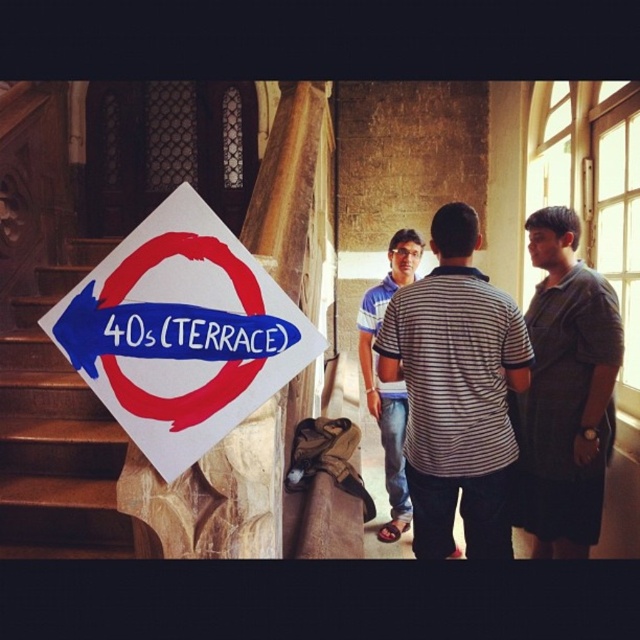
Describe the element at coordinates (180, 332) in the screenshot. This screenshot has height=640, width=640. I see `white paper sign at upper left` at that location.

Can you confirm if white paper sign at upper left is taller than striped cotton shirt at center?

Incorrect, white paper sign at upper left's height is not larger of striped cotton shirt at center's.

Who is more forward, (129,435) or (496,541)?

Point (129,435) is in front.

Locate an element on the screen. The height and width of the screenshot is (640, 640). white paper sign at upper left is located at coordinates (180, 332).

Can you confirm if striped cotton shirt at center is bigger than dark gray striped shirt at right?

Correct, striped cotton shirt at center is larger in size than dark gray striped shirt at right.

Find the location of a particular element. This screenshot has height=640, width=640. striped cotton shirt at center is located at coordinates (456, 392).

What do you see at coordinates (456, 392) in the screenshot?
I see `striped cotton shirt at center` at bounding box center [456, 392].

Find the location of a particular element. This screenshot has height=640, width=640. striped cotton shirt at center is located at coordinates (456, 392).

Does white paper sign at upper left have a larger size compared to blue striped shirt at center?

Actually, white paper sign at upper left might be smaller than blue striped shirt at center.

Is white paper sign at upper left positioned in front of blue striped shirt at center?

Yes.

Which is behind, point (92, 284) or point (403, 282)?

The point (403, 282) is more distant.

Where is `white paper sign at upper left`? white paper sign at upper left is located at coordinates (180, 332).